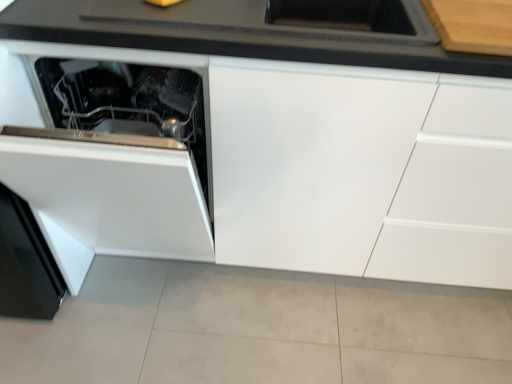
Question: Considering the relative positions of white glossy cabinet at center and white glossy oven at lower left in the image provided, is white glossy cabinet at center in front of white glossy oven at lower left?

Choices:
 (A) yes
 (B) no

Answer: (B)

Question: Is white glossy cabinet at center oriented towards white glossy oven at lower left?

Choices:
 (A) yes
 (B) no

Answer: (A)

Question: Can you confirm if white glossy cabinet at center is smaller than white glossy oven at lower left?

Choices:
 (A) yes
 (B) no

Answer: (B)

Question: From a real-world perspective, is white glossy cabinet at center positioned over white glossy oven at lower left based on gravity?

Choices:
 (A) yes
 (B) no

Answer: (B)

Question: Is white glossy cabinet at center turned away from white glossy oven at lower left?

Choices:
 (A) no
 (B) yes

Answer: (B)

Question: Visually, is white glossy cabinet at center positioned to the left or to the right of black matte countertop at upper center?

Choices:
 (A) right
 (B) left

Answer: (A)

Question: In terms of height, does white glossy cabinet at center look taller or shorter compared to black matte countertop at upper center?

Choices:
 (A) tall
 (B) short

Answer: (A)

Question: From the image's perspective, is white glossy cabinet at center above or below black matte countertop at upper center?

Choices:
 (A) below
 (B) above

Answer: (A)

Question: Is white glossy cabinet at center situated inside black matte countertop at upper center or outside?

Choices:
 (A) inside
 (B) outside

Answer: (B)

Question: In terms of width, does white glossy oven at lower left look wider or thinner when compared to black matte countertop at upper center?

Choices:
 (A) thin
 (B) wide

Answer: (B)

Question: Considering the relative positions of white glossy oven at lower left and black matte countertop at upper center in the image provided, is white glossy oven at lower left to the left or to the right of black matte countertop at upper center?

Choices:
 (A) right
 (B) left

Answer: (B)

Question: Do you think white glossy oven at lower left is within black matte countertop at upper center, or outside of it?

Choices:
 (A) outside
 (B) inside

Answer: (A)

Question: In the image, is white glossy oven at lower left positioned in front of or behind black matte countertop at upper center?

Choices:
 (A) behind
 (B) front

Answer: (B)

Question: From their relative heights in the image, would you say black matte countertop at upper center is taller or shorter than white glossy cabinet at center?

Choices:
 (A) tall
 (B) short

Answer: (B)

Question: Visually, is black matte countertop at upper center positioned to the left or to the right of white glossy cabinet at center?

Choices:
 (A) right
 (B) left

Answer: (B)